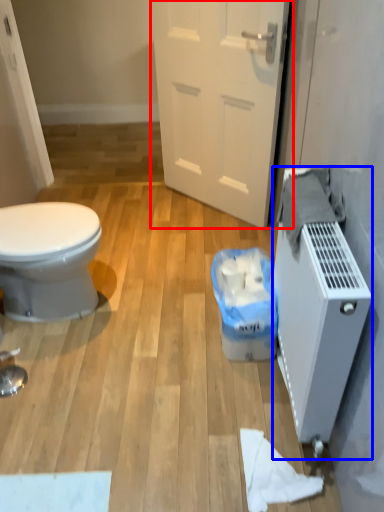
Question: Which object is further to the camera taking this photo, door (highlighted by a red box) or water heater (highlighted by a blue box)?

Choices:
 (A) door
 (B) water heater

Answer: (A)